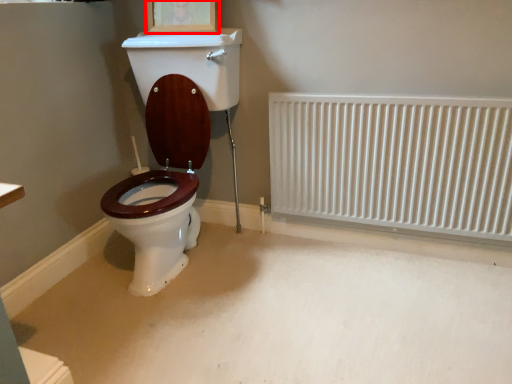
Question: From the image's perspective, what is the correct spatial relationship of picture frame (annotated by the red box) in relation to radiator?

Choices:
 (A) above
 (B) below

Answer: (A)